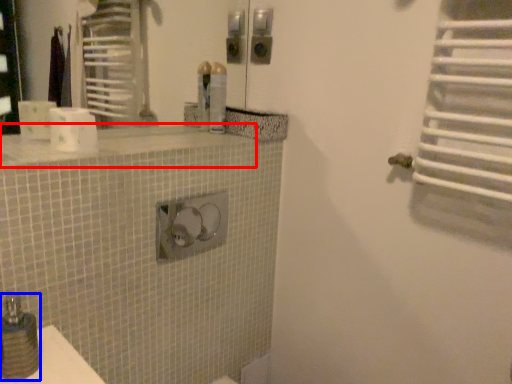
Question: Among these objects, which one is farthest to the camera, counter top (highlighted by a red box) or soap dispenser (highlighted by a blue box)?

Choices:
 (A) counter top
 (B) soap dispenser

Answer: (A)